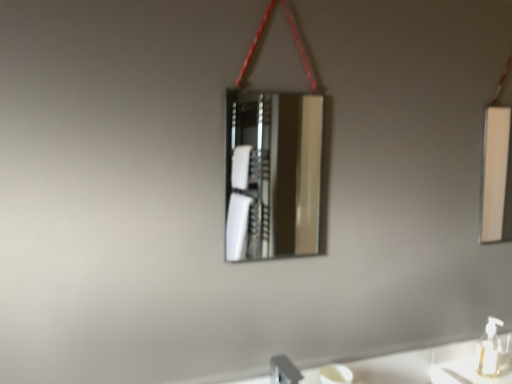
Question: Considering the positions of white glossy mirror at right, the 1th mirror when ordered from back to front, and silver metallic faucet at lower center in the image, is white glossy mirror at right, the 1th mirror when ordered from back to front, taller or shorter than silver metallic faucet at lower center?

Choices:
 (A) short
 (B) tall

Answer: (B)

Question: Considering their positions, is white glossy mirror at right, the 1th mirror when ordered from back to front, located in front of or behind silver metallic faucet at lower center?

Choices:
 (A) behind
 (B) front

Answer: (A)

Question: Estimate the real-world distances between objects in this image. Which object is closer to the white glossy mirror at right, the 1th mirror when ordered from back to front?

Choices:
 (A) silver metallic faucet at lower center
 (B) white plastic soap dispenser at lower right
 (C) polished silver mirror at center, placed as the first mirror when sorted from left to right

Answer: (C)

Question: Considering the real-world distances, which object is closest to the white glossy mirror at right, placed as the 2th mirror when sorted from front to back?

Choices:
 (A) polished silver mirror at center, which ranks as the first mirror in front-to-back order
 (B) white plastic soap dispenser at lower right
 (C) silver metallic faucet at lower center

Answer: (A)